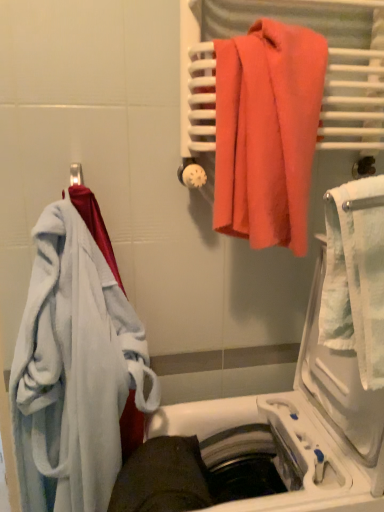
Question: Is soft white bathrobe at left, which is counted as the second towel, starting from the top, shorter than coral fabric towel at upper right, which is counted as the first towel, starting from the top?

Choices:
 (A) yes
 (B) no

Answer: (B)

Question: Can you see soft white bathrobe at left, which is counted as the first towel, starting from the left, touching coral fabric towel at upper right, the second towel positioned from the left?

Choices:
 (A) yes
 (B) no

Answer: (B)

Question: Does soft white bathrobe at left, the 1th towel when ordered from bottom to top, have a greater height compared to coral fabric towel at upper right, which is the 2th towel from bottom to top?

Choices:
 (A) no
 (B) yes

Answer: (B)

Question: Could you tell me if soft white bathrobe at left, the second towel from the right, is facing coral fabric towel at upper right, which is the 2th towel from bottom to top?

Choices:
 (A) no
 (B) yes

Answer: (A)

Question: From the image's perspective, is soft white bathrobe at left, the second towel from the right, on coral fabric towel at upper right, which is the 2th towel from bottom to top?

Choices:
 (A) yes
 (B) no

Answer: (B)

Question: Is point (364, 439) closer or farther from the camera than point (150, 457)?

Choices:
 (A) farther
 (B) closer

Answer: (B)

Question: Considering the positions of white textured towel at right and white plastic dishwasher at lower center in the image, is white textured towel at right taller or shorter than white plastic dishwasher at lower center?

Choices:
 (A) tall
 (B) short

Answer: (B)

Question: Which is correct: white textured towel at right is inside white plastic dishwasher at lower center, or outside of it?

Choices:
 (A) outside
 (B) inside

Answer: (A)

Question: Would you say white textured towel at right is to the left or to the right of white plastic dishwasher at lower center in the picture?

Choices:
 (A) left
 (B) right

Answer: (B)

Question: Considering their positions, is white textured towel at right located in front of or behind soft white bathrobe at left, which is counted as the first towel, starting from the left?

Choices:
 (A) front
 (B) behind

Answer: (A)

Question: Is white textured towel at right taller or shorter than soft white bathrobe at left, which is counted as the second towel, starting from the top?

Choices:
 (A) tall
 (B) short

Answer: (B)

Question: Is white textured towel at right wider or thinner than soft white bathrobe at left, which is counted as the first towel, starting from the left?

Choices:
 (A) thin
 (B) wide

Answer: (A)

Question: Is white textured towel at right bigger or smaller than soft white bathrobe at left, the second towel from the right?

Choices:
 (A) big
 (B) small

Answer: (B)

Question: Does point (364, 481) appear closer or farther from the camera than point (354, 410)?

Choices:
 (A) farther
 (B) closer

Answer: (B)

Question: Looking at the image, does white plastic dishwasher at lower center seem bigger or smaller compared to white textured towel at right?

Choices:
 (A) big
 (B) small

Answer: (A)